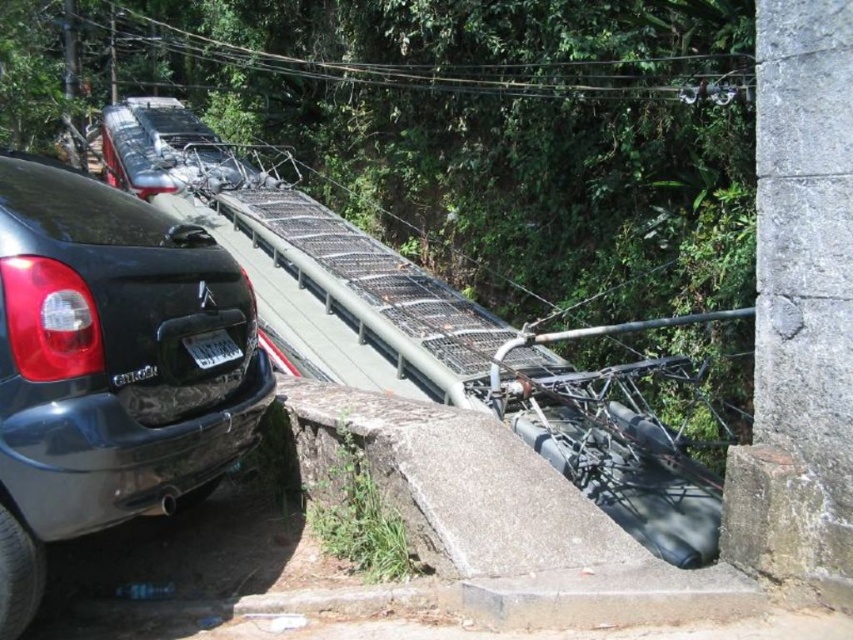
Does matte black car at left have a larger size compared to black wire at upper center?

Incorrect, matte black car at left is not larger than black wire at upper center.

Is matte black car at left positioned in front of black wire at upper center?

Yes.

Image resolution: width=853 pixels, height=640 pixels. Describe the element at coordinates (108, 368) in the screenshot. I see `matte black car at left` at that location.

I want to click on matte black car at left, so click(x=108, y=368).

Which of these two, black wire at upper center or white plastic license plate at center, stands shorter?

white plastic license plate at center

Looking at this image, between black wire at upper center and white plastic license plate at center, which one is positioned lower?

white plastic license plate at center is lower down.

Image resolution: width=853 pixels, height=640 pixels. In order to click on black wire at upper center in this screenshot , I will do `click(450, 65)`.

Can you confirm if matte black car at left is thinner than white plastic license plate at center?

In fact, matte black car at left might be wider than white plastic license plate at center.

Who is shorter, matte black car at left or white plastic license plate at center?

white plastic license plate at center is shorter.

This screenshot has height=640, width=853. In order to click on matte black car at left in this screenshot , I will do point(108,368).